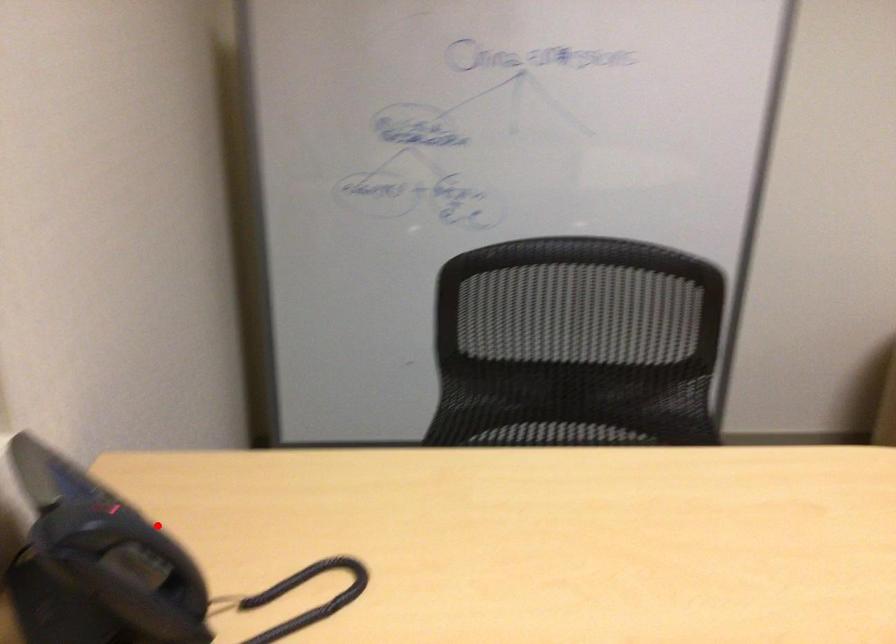
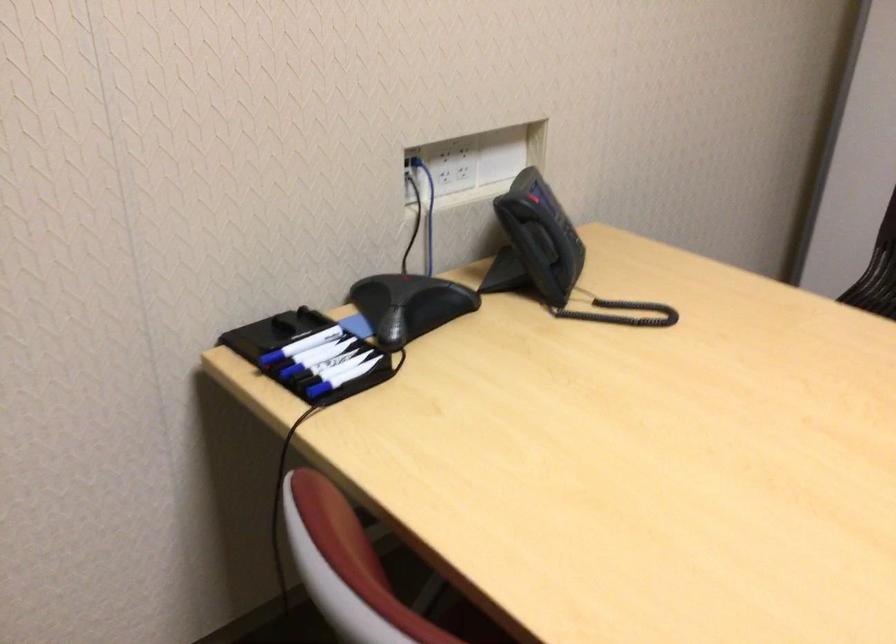
Where in the second image is the point corresponding to the highlighted location from the first image?

(562, 225)